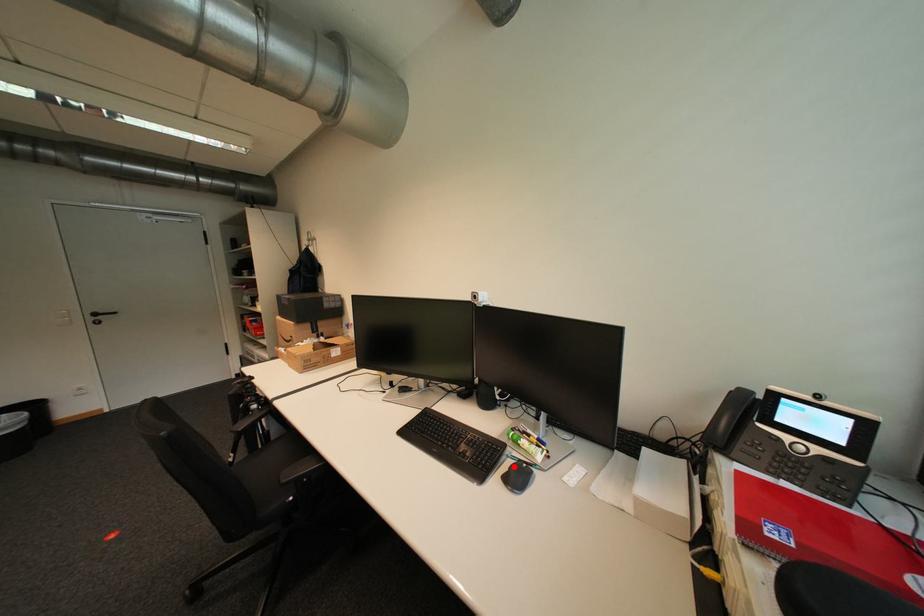
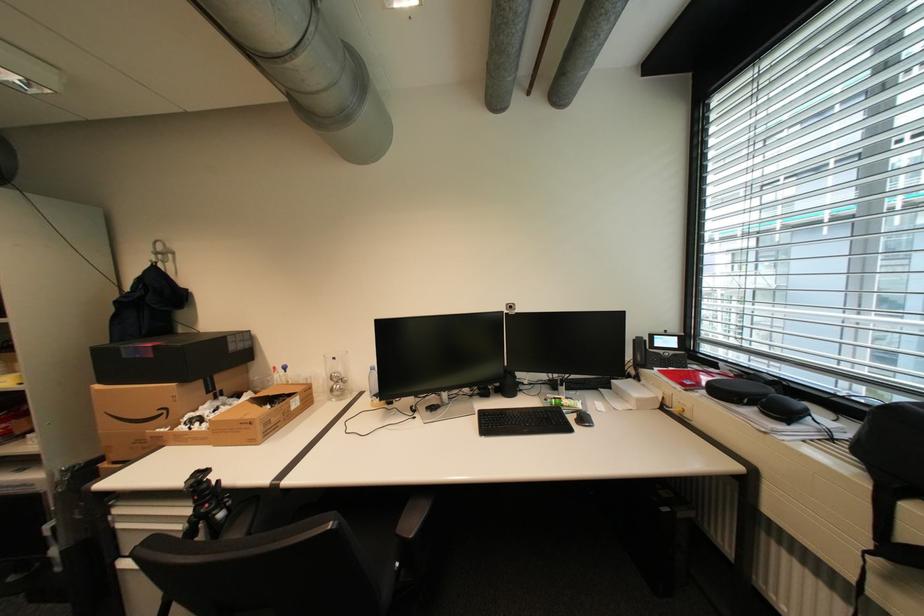
In the second image, find the point that corresponds to the highlighted location in the first image.

(579, 419)